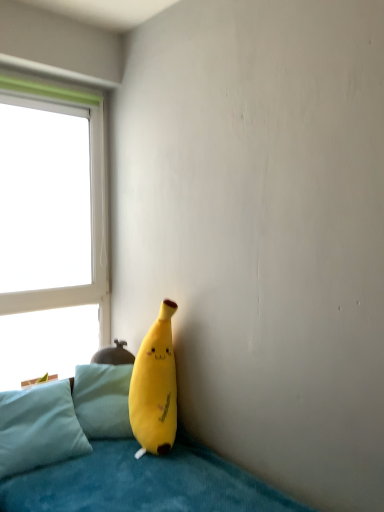
Question: Should I look upward or downward to see yellow plush toy at lower center?

Choices:
 (A) down
 (B) up

Answer: (A)

Question: Is light blue plush pillow at lower left to the right of soft blue fabric couch at lower left from the viewer's perspective?

Choices:
 (A) no
 (B) yes

Answer: (A)

Question: Is light blue plush pillow at lower left further to the viewer compared to soft blue fabric couch at lower left?

Choices:
 (A) no
 (B) yes

Answer: (B)

Question: Considering the relative sizes of light blue plush pillow at lower left and soft blue fabric couch at lower left in the image provided, is light blue plush pillow at lower left shorter than soft blue fabric couch at lower left?

Choices:
 (A) no
 (B) yes

Answer: (B)

Question: Considering the relative positions of light blue plush pillow at lower left and soft blue fabric couch at lower left in the image provided, is light blue plush pillow at lower left to the left of soft blue fabric couch at lower left from the viewer's perspective?

Choices:
 (A) yes
 (B) no

Answer: (A)

Question: From a real-world perspective, is light blue plush pillow at lower left positioned under soft blue fabric couch at lower left based on gravity?

Choices:
 (A) yes
 (B) no

Answer: (B)

Question: Considering the relative sizes of light blue plush pillow at lower left and soft blue fabric couch at lower left in the image provided, is light blue plush pillow at lower left taller than soft blue fabric couch at lower left?

Choices:
 (A) no
 (B) yes

Answer: (A)

Question: Does soft blue fabric couch at lower left appear on the right side of light blue plush pillow at lower left?

Choices:
 (A) yes
 (B) no

Answer: (A)

Question: Can you confirm if soft blue fabric couch at lower left is wider than light blue plush pillow at lower left?

Choices:
 (A) yes
 (B) no

Answer: (A)

Question: Is soft blue fabric couch at lower left far away from light blue plush pillow at lower left?

Choices:
 (A) no
 (B) yes

Answer: (A)

Question: Is soft blue fabric couch at lower left facing away from light blue plush pillow at lower left?

Choices:
 (A) yes
 (B) no

Answer: (A)

Question: Is soft blue fabric couch at lower left in front of light blue plush pillow at lower left?

Choices:
 (A) yes
 (B) no

Answer: (A)

Question: Can you confirm if soft blue fabric couch at lower left is taller than light blue plush pillow at lower left?

Choices:
 (A) yes
 (B) no

Answer: (A)

Question: Considering the relative sizes of yellow plush toy at lower center and white plastic window at upper left in the image provided, is yellow plush toy at lower center bigger than white plastic window at upper left?

Choices:
 (A) no
 (B) yes

Answer: (A)